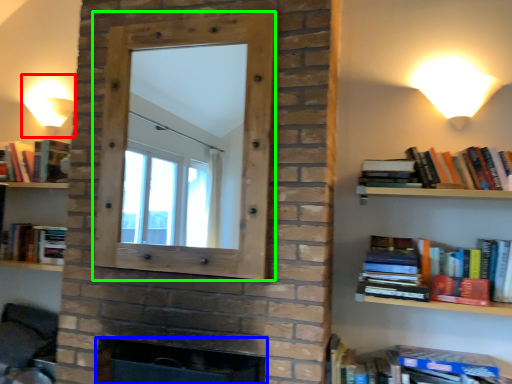
Question: Which is nearer to the table lamp (highlighted by a red box)? fireplace (highlighted by a blue box) or window frame (highlighted by a green box).

Choices:
 (A) fireplace
 (B) window frame

Answer: (B)